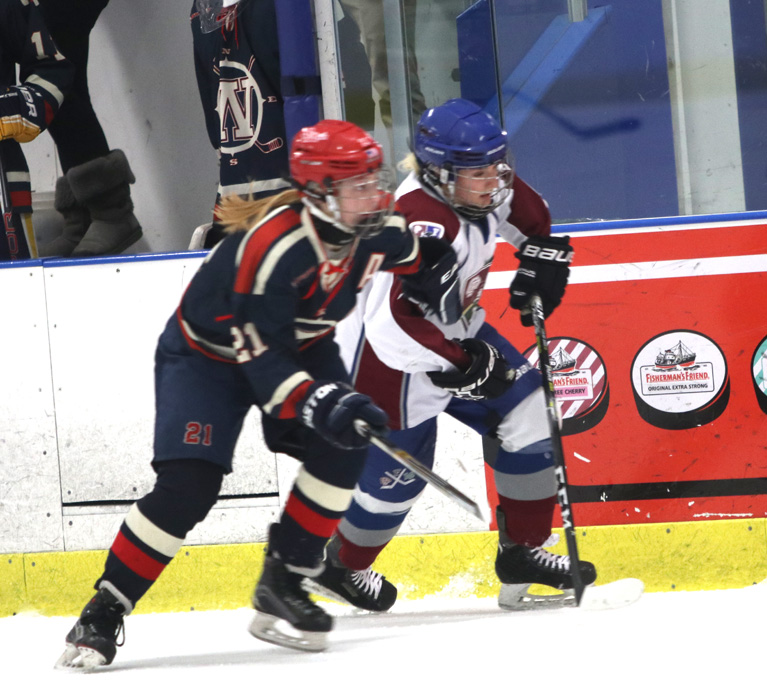
Find the location of a particular element. This screenshot has height=693, width=767. glass board is located at coordinates (630, 98), (426, 67).